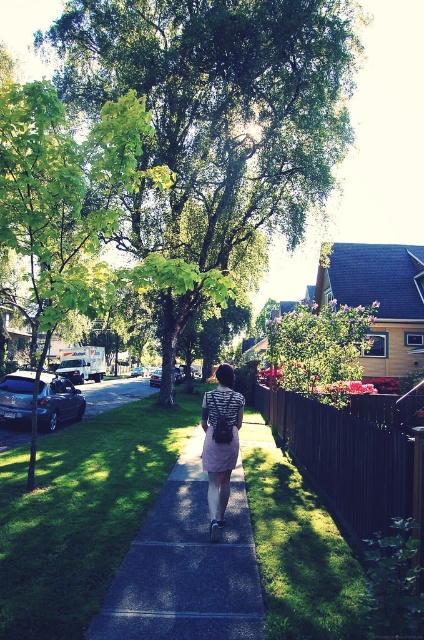
Consider the image. You are a painter standing on the sidewalk and want to paint the scene. The canvas you have is 1.5 meters wide. If you want to capture both the green leafy tree at center and the patterned fabric dress at center in your painting, will the width of the canvas be sufficient?

The green leafy tree at center might be wider than the patterned fabric dress at center, so the total width required to include both could exceed the 1.5 meters. It depends on their actual widths, but there is a possibility the canvas may not be sufficient.

You are standing at the starting point of the sidewalk and want to reach the flowerbeds near the wooden fence. The green leafy tree at center is in your path. Can you walk around it to the left or right side?

The green leafy tree at center is located at point [217,109], so you can walk around it either to the left or right side to reach the flowerbeds near the wooden fence.